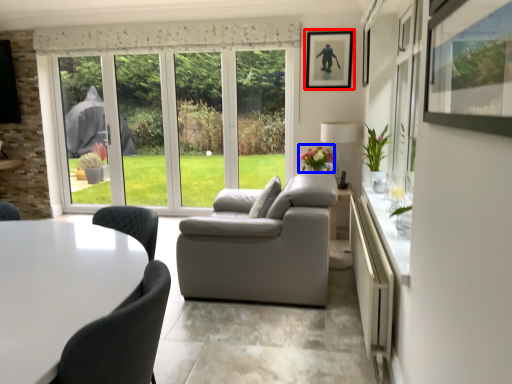
Question: Which object is further to the camera taking this photo, picture frame (highlighted by a red box) or flower (highlighted by a blue box)?

Choices:
 (A) picture frame
 (B) flower

Answer: (A)